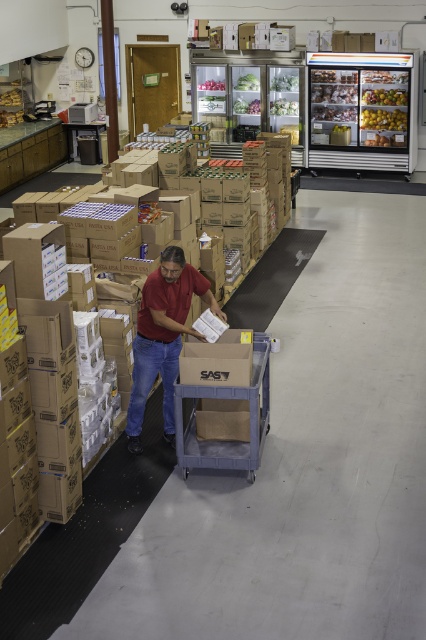
You are a customer in the store and want to know if the shiny plastic apples at upper center are larger than the matte red shirt at center. Can you tell me?

The matte red shirt at center is bigger than shiny plastic apples at upper center, so the shiny plastic apples at upper center are smaller than the matte red shirt at center.